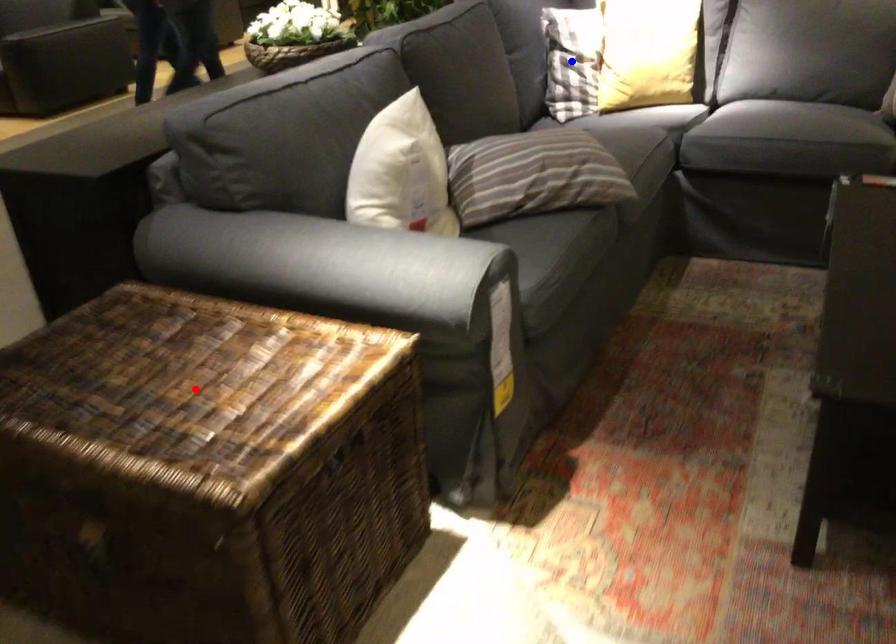
Question: Two points are marked on the image. Which point is closer to the camera?

Choices:
 (A) Blue point is closer.
 (B) Red point is closer.

Answer: (B)